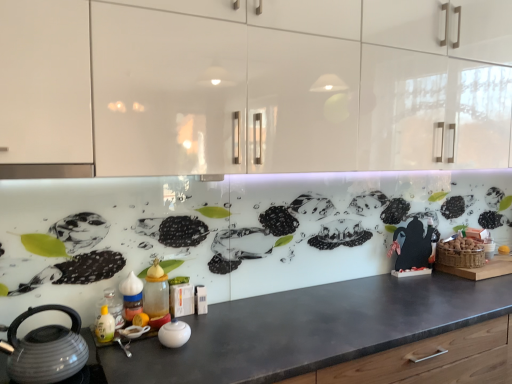
At what (x,y) coordinates should I click in order to perform the action: click on vacant space in between matte gray kettle at lower left and white glossy bowl at center. Please return your answer as a coordinate pair (x, y). Looking at the image, I should click on coord(125,352).